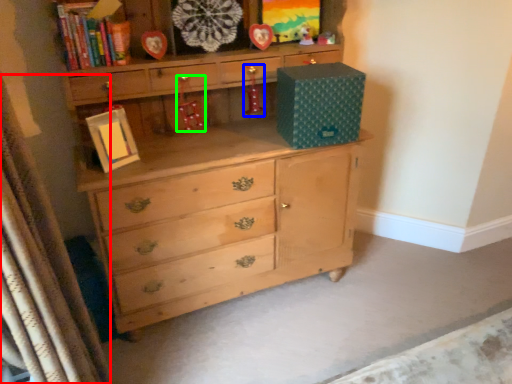
Question: Which object is positioned farthest from curtain (highlighted by a red box)? Select from toy (highlighted by a blue box) and toy (highlighted by a green box).

Choices:
 (A) toy
 (B) toy

Answer: (A)